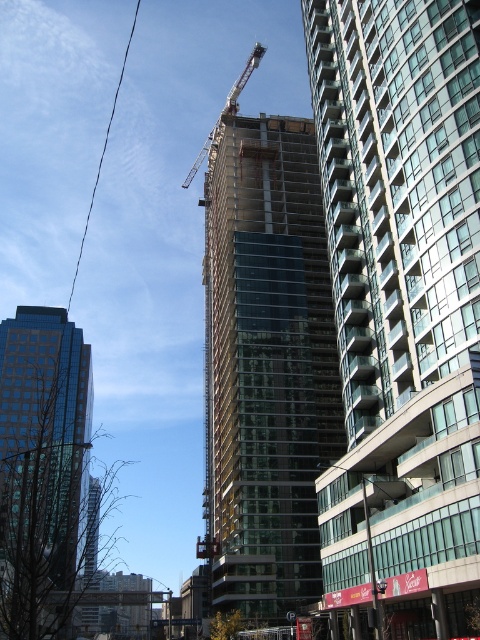
Who is higher up, transparent glass building at center or shiny glass skyscraper at left?

transparent glass building at center is higher up.

Can you confirm if transparent glass building at center is taller than shiny glass skyscraper at left?

Correct, transparent glass building at center is much taller as shiny glass skyscraper at left.

Between point (235, 525) and point (15, 490), which one is positioned behind?

Point (15, 490)

At what (x,y) coordinates should I click in order to perform the action: click on transparent glass building at center. Please return your answer as a coordinate pair (x, y). Looking at the image, I should click on (265, 364).

Looking at this image, can you confirm if shiny glass skyscraper at left is positioned to the right of metallic gray crane at upper center?

In fact, shiny glass skyscraper at left is to the left of metallic gray crane at upper center.

Does point (38, 428) come closer to viewer compared to point (226, 106)?

No, it is behind (226, 106).

Image resolution: width=480 pixels, height=640 pixels. Describe the element at coordinates (40, 465) in the screenshot. I see `shiny glass skyscraper at left` at that location.

Find the location of a particular element. shiny glass skyscraper at left is located at coordinates (40, 465).

Is transparent glass building at center positioned behind metallic gray crane at upper center?

No, it is in front of metallic gray crane at upper center.

The image size is (480, 640). Identify the location of transparent glass building at center. (265, 364).

Who is more distant from viewer, (247,566) or (237,106)?

The point (237,106) is behind.

Where is `transparent glass building at center`? Image resolution: width=480 pixels, height=640 pixels. transparent glass building at center is located at coordinates (265, 364).